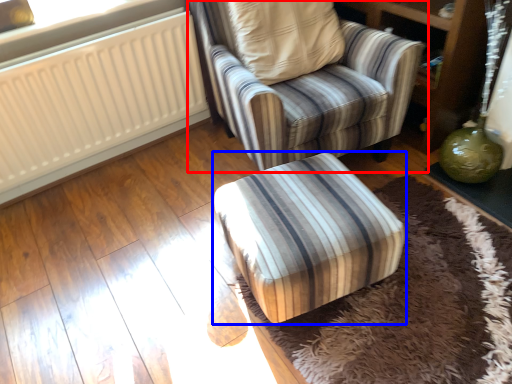
Question: Among these objects, which one is farthest to the camera, chair (highlighted by a red box) or furniture (highlighted by a blue box)?

Choices:
 (A) chair
 (B) furniture

Answer: (A)